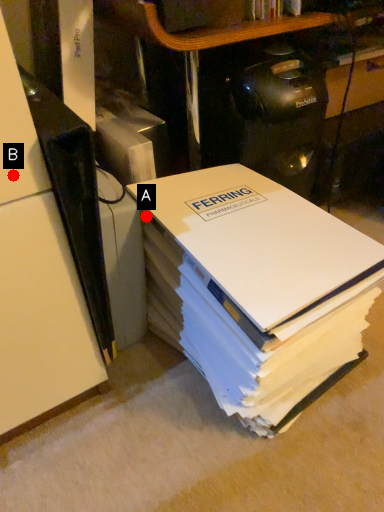
Question: Two points are circled on the image, labeled by A and B beside each circle. Which point is closer to the camera taking this photo?

Choices:
 (A) A is closer
 (B) B is closer

Answer: (B)